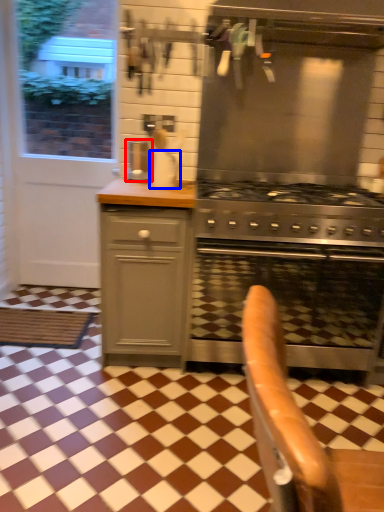
Question: Which object appears closest to the camera in this image, coffee machine (highlighted by a red box) or kitchen appliance (highlighted by a blue box)?

Choices:
 (A) coffee machine
 (B) kitchen appliance

Answer: (B)